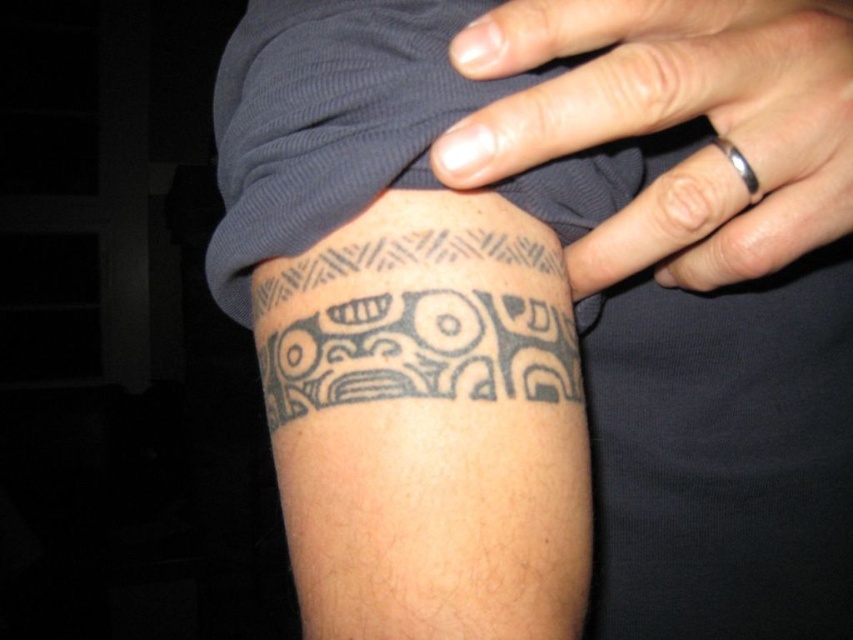
Question: Can you confirm if black matte ring at upper center is wider than black ink tattoo at lower center?

Choices:
 (A) no
 (B) yes

Answer: (B)

Question: Is black matte ring at upper center positioned before black ink tattoo at lower center?

Choices:
 (A) yes
 (B) no

Answer: (A)

Question: Which object appears farthest from the camera in this image?

Choices:
 (A) black matte ring at upper center
 (B) black ink tattoo at lower center

Answer: (B)

Question: Among these points, which one is farthest from the camera?

Choices:
 (A) (645, 16)
 (B) (476, 305)

Answer: (B)

Question: Observing the image, what is the correct spatial positioning of black matte ring at upper center in reference to black ink tattoo at lower center?

Choices:
 (A) left
 (B) right

Answer: (B)